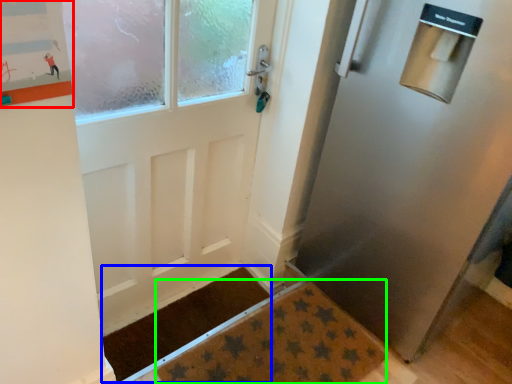
Question: Based on their relative distances, which object is farther from bulletin board (highlighted by a red box)? Choose from doormat (highlighted by a blue box) and doormat (highlighted by a green box).

Choices:
 (A) doormat
 (B) doormat

Answer: (A)